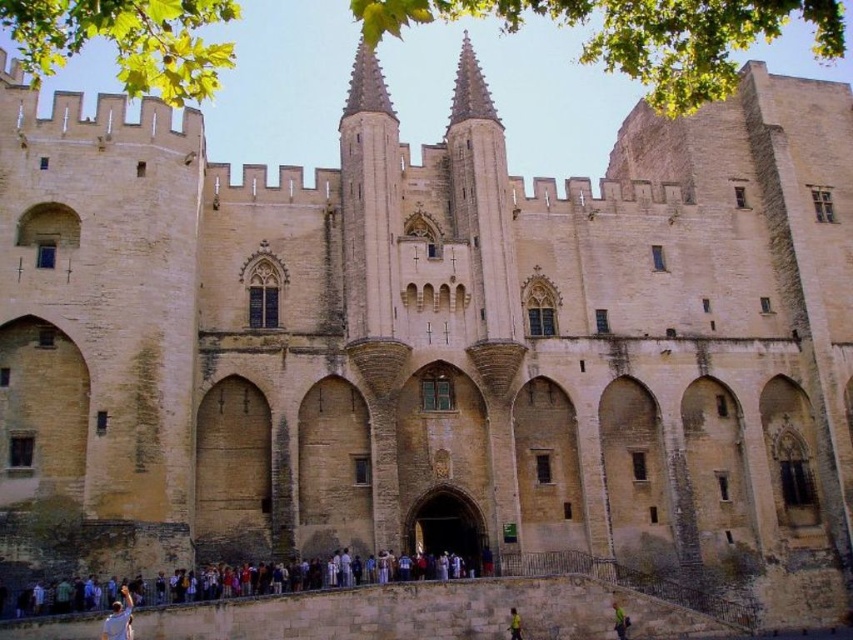
Question: Is multicolored fabric crowd at lower center positioned in front of light blue fabric at lower left?

Choices:
 (A) no
 (B) yes

Answer: (A)

Question: Which object appears closest to the camera in this image?

Choices:
 (A) multicolored fabric crowd at lower center
 (B) yellow shirt at lower center

Answer: (A)

Question: Which point is closer to the camera taking this photo?

Choices:
 (A) (281, 586)
 (B) (112, 608)

Answer: (B)

Question: Can you confirm if multicolored fabric crowd at lower center is wider than light blue fabric at lower left?

Choices:
 (A) yes
 (B) no

Answer: (A)

Question: Among these objects, which one is nearest to the camera?

Choices:
 (A) light blue fabric at lower left
 (B) multicolored fabric crowd at lower center

Answer: (A)

Question: From the image, what is the correct spatial relationship of multicolored fabric crowd at lower center in relation to light blue fabric at lower left?

Choices:
 (A) below
 (B) above

Answer: (A)